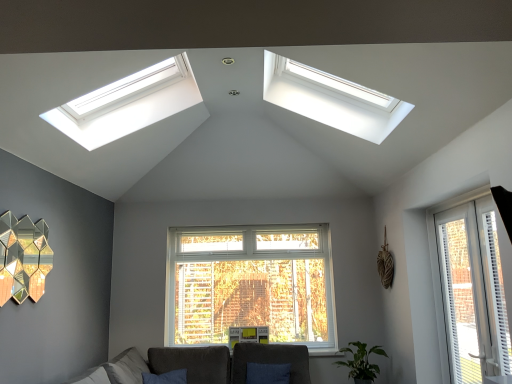
At what (x,y) coordinates should I click in order to perform the action: click on green matte plant at lower right. Please return your answer as a coordinate pair (x, y). Image resolution: width=512 pixels, height=384 pixels. Looking at the image, I should click on (361, 362).

Where is `white plastic blinds at right`? The width and height of the screenshot is (512, 384). white plastic blinds at right is located at coordinates (496, 293).

What is the approximate width of velvet dark gray armchair at center?

The width of velvet dark gray armchair at center is 6.00 inches.

Where is `dark gray fabric couch at lower center`? This screenshot has height=384, width=512. dark gray fabric couch at lower center is located at coordinates point(229,362).

Is green matte plant at lower right situated inside velvet dark gray armchair at center or outside?

green matte plant at lower right exists outside the volume of velvet dark gray armchair at center.

The height and width of the screenshot is (384, 512). In order to click on armchair below the green matte plant at lower right (from a real-world perspective) in this screenshot , I will do `click(271, 359)`.

Considering the positions of objects green matte plant at lower right and velvet dark gray armchair at center in the image provided, who is in front, green matte plant at lower right or velvet dark gray armchair at center?

green matte plant at lower right.

Considering the sizes of objects green matte plant at lower right and velvet dark gray armchair at center in the image provided, who is thinner, green matte plant at lower right or velvet dark gray armchair at center?

velvet dark gray armchair at center is thinner.

Is the depth of velvet dark gray armchair at center greater than that of dark gray fabric couch at lower center?

Yes, it is.

Which of these two, velvet dark gray armchair at center or dark gray fabric couch at lower center, is thinner?

Thinner between the two is velvet dark gray armchair at center.

Which of these two, velvet dark gray armchair at center or dark gray fabric couch at lower center, is bigger?

Bigger between the two is dark gray fabric couch at lower center.

How different are the orientations of green matte plant at lower right and white plastic blinds at right in degrees?

91.9 degrees.

Which of these two, green matte plant at lower right or white plastic blinds at right, is smaller?

Smaller between the two is white plastic blinds at right.

Is green matte plant at lower right located outside white plastic blinds at right?

That's correct, green matte plant at lower right is outside of white plastic blinds at right.

Is green matte plant at lower right facing away from white plastic blinds at right?

green matte plant at lower right is not turned away from white plastic blinds at right.

In terms of width, does white plastic blinds at right look wider or thinner when compared to dark gray fabric couch at lower center?

Considering their sizes, white plastic blinds at right looks slimmer than dark gray fabric couch at lower center.

Can you confirm if white plastic blinds at right is shorter than dark gray fabric couch at lower center?

In fact, white plastic blinds at right may be taller than dark gray fabric couch at lower center.

Based on the photo, how many degrees apart are the facing directions of white plastic blinds at right and dark gray fabric couch at lower center?

They differ by 179 degrees in their facing directions.

Is dark gray fabric couch at lower center at the back of white plastic blinds at right?

white plastic blinds at right does not have its back to dark gray fabric couch at lower center.

Which is closer to the camera, (124, 98) or (480, 318)?

Point (124, 98) is positioned farther from the camera compared to point (480, 318).

Between white plastic skylight at upper center, the first window viewed from the left, and white plastic window at right, marked as the 2th window in a left-to-right arrangement, which one is positioned in front?

Positioned in front is white plastic window at right, marked as the 2th window in a left-to-right arrangement.

From the image's perspective, is white plastic skylight at upper center, which is the second window in bottom-to-top order, located above white plastic window at right, which is the first window from bottom to top?

Yes.

Consider the image. How many degrees apart are the facing directions of white plastic skylight at upper center, the 2th window in the right-to-left sequence, and white plastic window at right, marked as the 2th window in a left-to-right arrangement?

They differ by 180 degrees in their facing directions.

Which of these two, white plastic blinds at right or green matte plant at lower right, stands taller?

white plastic blinds at right is taller.

Is white plastic blinds at right thinner than green matte plant at lower right?

Yes.

Are white plastic blinds at right and green matte plant at lower right making contact?

No, white plastic blinds at right is not with green matte plant at lower right.

Can you confirm if dark gray fabric couch at lower center is thinner than gold hexagonal mirror at left?

In fact, dark gray fabric couch at lower center might be wider than gold hexagonal mirror at left.

Can you confirm if dark gray fabric couch at lower center is taller than gold hexagonal mirror at left?

No, dark gray fabric couch at lower center is not taller than gold hexagonal mirror at left.

Is gold hexagonal mirror at left completely or partially inside dark gray fabric couch at lower center?

Actually, gold hexagonal mirror at left is outside dark gray fabric couch at lower center.

Can you see dark gray fabric couch at lower center touching gold hexagonal mirror at left?

No, dark gray fabric couch at lower center is not in contact with gold hexagonal mirror at left.

I want to click on houseplant that appears on the right of velvet dark gray armchair at center, so click(361, 362).

Where is `couch lying in front of the velvet dark gray armchair at center`? This screenshot has height=384, width=512. couch lying in front of the velvet dark gray armchair at center is located at coordinates (229, 362).

Estimate the real-world distances between objects in this image. Which object is further from green matte plant at lower right, velvet dark gray armchair at center or white plastic window at right, which is the 1th window from right to left?

white plastic window at right, which is the 1th window from right to left, is further to green matte plant at lower right.

Based on their spatial positions, is green matte plant at lower right or gold hexagonal mirror at left further from dark gray fabric couch at lower center?

gold hexagonal mirror at left is positioned further to the anchor dark gray fabric couch at lower center.

Estimate the real-world distances between objects in this image. Which object is closer to dark gray fabric couch at lower center, white plastic skylight at upper center, the 1th window in the top-to-bottom sequence, or gold hexagonal mirror at left?

gold hexagonal mirror at left.

Based on their spatial positions, is gold hexagonal mirror at left or velvet dark gray armchair at center closer to green matte plant at lower right?

velvet dark gray armchair at center lies closer to green matte plant at lower right than the other object.

Consider the image. From the image, which object appears to be nearer to white plastic blinds at right, white plastic window at right, which is the 1th window from right to left, or velvet dark gray armchair at center?

white plastic window at right, which is the 1th window from right to left, is closer to white plastic blinds at right.

When comparing their distances from white plastic blinds at right, does dark gray fabric couch at lower center or green matte plant at lower right seem closer?

The object closer to white plastic blinds at right is green matte plant at lower right.

Looking at this image, considering their positions, is dark gray fabric couch at lower center positioned closer to gold hexagonal mirror at left than green matte plant at lower right?

dark gray fabric couch at lower center.

When comparing their distances from velvet dark gray armchair at center, does dark gray fabric couch at lower center or white plastic blinds at right seem closer?

Based on the image, dark gray fabric couch at lower center appears to be nearer to velvet dark gray armchair at center.

This screenshot has width=512, height=384. In order to click on window situated between gold hexagonal mirror at left and green matte plant at lower right from left to right in this screenshot , I will do `click(128, 104)`.

Image resolution: width=512 pixels, height=384 pixels. I want to click on couch between gold hexagonal mirror at left and white plastic window at right, which is the 1th window from right to left, in the horizontal direction, so click(x=229, y=362).

The image size is (512, 384). Identify the location of armchair between white plastic skylight at upper center, the 1th window in the top-to-bottom sequence, and white plastic blinds at right. (271, 359).

Image resolution: width=512 pixels, height=384 pixels. I want to click on lamp between white plastic skylight at upper center, the 2th window in the right-to-left sequence, and velvet dark gray armchair at center, in the vertical direction, so click(23, 258).